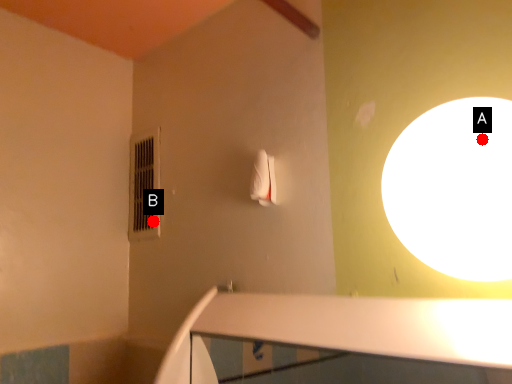
Question: Two points are circled on the image, labeled by A and B beside each circle. Which point appears farthest from the camera in this image?

Choices:
 (A) A is further
 (B) B is further

Answer: (B)